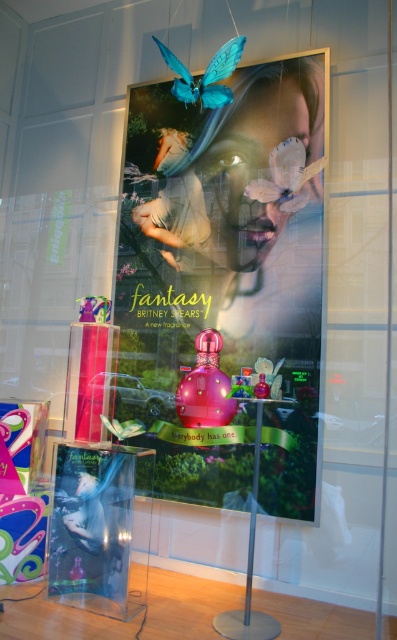
Question: Considering the relative positions of glossy plastic poster at center and teal matte butterfly at upper center in the image provided, where is glossy plastic poster at center located with respect to teal matte butterfly at upper center?

Choices:
 (A) above
 (B) below

Answer: (B)

Question: Among these objects, which one is farthest from the camera?

Choices:
 (A) glossy plastic poster at center
 (B) translucent plastic bottle at lower left

Answer: (A)

Question: Which point is closer to the camera?

Choices:
 (A) (316, 259)
 (B) (229, 64)
 (C) (283, 166)
 (D) (192, 380)

Answer: (B)

Question: Does glossy plastic poster at center have a smaller size compared to teal matte butterfly at upper center?

Choices:
 (A) no
 (B) yes

Answer: (A)

Question: Which is farther from the translucent plastic bottle at lower left?

Choices:
 (A) translucent white butterfly at upper center
 (B) teal matte butterfly at upper center
 (C) pink glossy perfume at center

Answer: (B)

Question: Is glossy plastic poster at center behind pink glossy perfume at center?

Choices:
 (A) yes
 (B) no

Answer: (B)